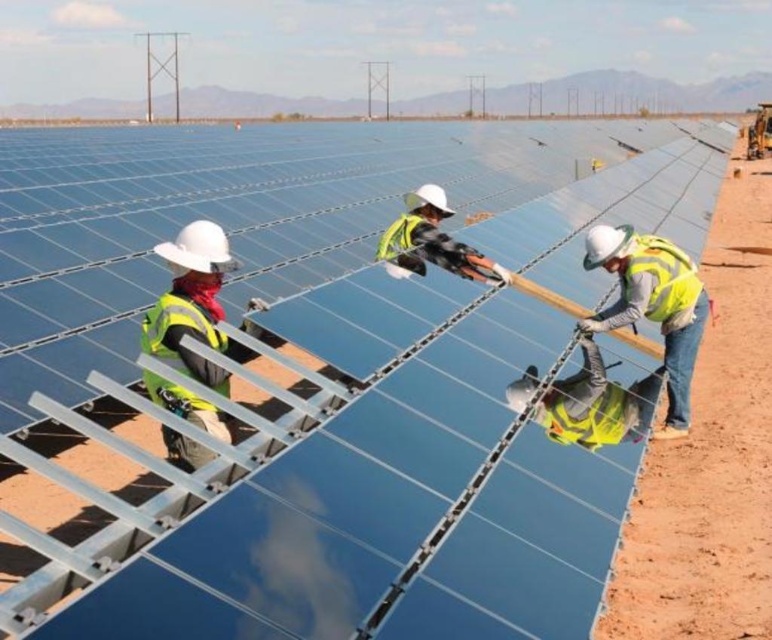
You are standing at the solar panel installation site. You need to reach a point marked at coordinates point (493, 268). If your maximum comfortable walking distance is 15 feet, can you comfortably walk to that point without needing assistance?

The distance of point (493, 268) from viewer is 15.44 feet, which is slightly beyond your maximum comfortable walking distance of 15 feet. Therefore, you may need assistance to reach that point comfortably.

You are a safety inspector at the solar panel site. You need to ensure that workers are maintaining a safe distance of at least 2 meters between each other for safety protocols. Looking at the two workers wearing yellow reflective safety vest at right and yellow reflective safety vest at center, are they following the safety distance requirement?

The yellow reflective safety vest at right is 1.53 meters away from the yellow reflective safety vest at center. Since the required distance is 2 meters, they are not maintaining the safe distance and are too close to each other.